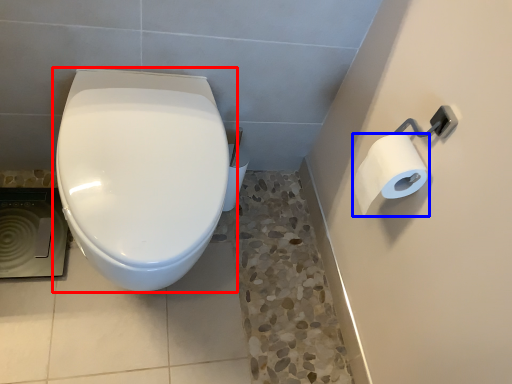
Question: Among these objects, which one is farthest to the camera, toilet (highlighted by a red box) or toilet paper (highlighted by a blue box)?

Choices:
 (A) toilet
 (B) toilet paper

Answer: (B)